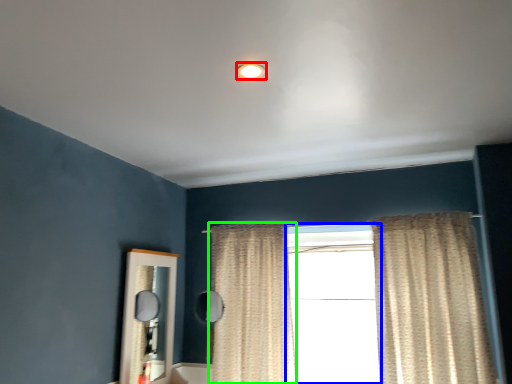
Question: Which object is positioned closest to lighting (highlighted by a red box)? Select from window (highlighted by a blue box) and curtain (highlighted by a green box).

Choices:
 (A) window
 (B) curtain

Answer: (B)